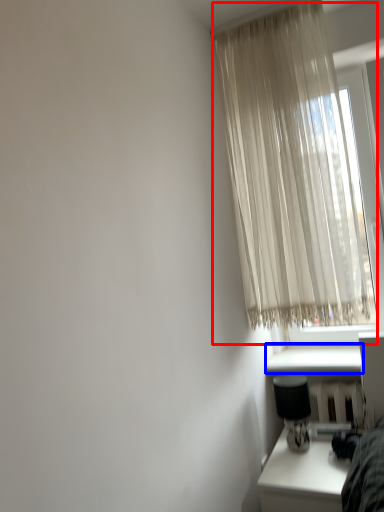
Question: Which of the following is the closest to the observer, curtain (highlighted by a red box) or window sill (highlighted by a blue box)?

Choices:
 (A) curtain
 (B) window sill

Answer: (A)